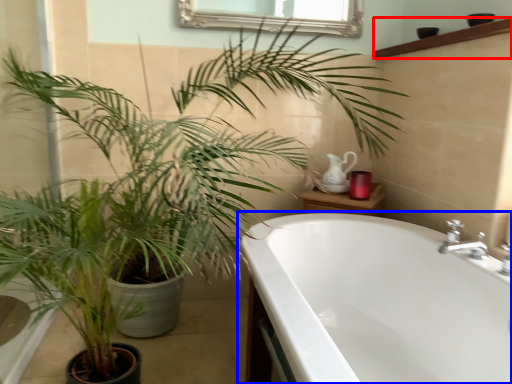
Question: Which point is further to the camera, balustrade (highlighted by a red box) or bathtub (highlighted by a blue box)?

Choices:
 (A) balustrade
 (B) bathtub

Answer: (A)